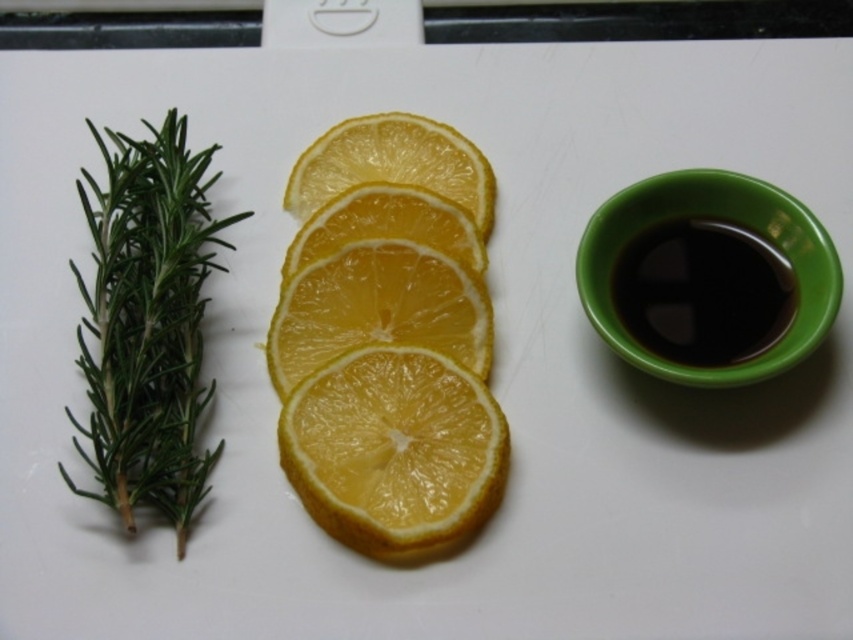
Is green needle-like rosemary at left in front of yellow matte lemon at center?

That is True.

Which is more to the right, green needle-like rosemary at left or yellow matte lemon at center?

From the viewer's perspective, yellow matte lemon at center appears more on the right side.

Describe the element at coordinates (148, 324) in the screenshot. The width and height of the screenshot is (853, 640). I see `green needle-like rosemary at left` at that location.

Find the location of a particular element. green needle-like rosemary at left is located at coordinates (148, 324).

Who is taller, green needle-like rosemary at left or black glossy coffee at right?

Standing taller between the two is green needle-like rosemary at left.

Does green needle-like rosemary at left appear on the right side of black glossy coffee at right?

No, green needle-like rosemary at left is not to the right of black glossy coffee at right.

Who is more distant from viewer, (114, 300) or (704, 333)?

The point (704, 333) is behind.

At what (x,y) coordinates should I click in order to perform the action: click on green needle-like rosemary at left. Please return your answer as a coordinate pair (x, y). Looking at the image, I should click on (148, 324).

Does yellow smooth orange at center have a smaller size compared to yellow matte orange at center?

Actually, yellow smooth orange at center might be larger than yellow matte orange at center.

Does yellow smooth orange at center have a lesser height compared to yellow matte orange at center?

No.

Who is more distant from viewer, (476, 346) or (468, 266)?

Positioned behind is point (468, 266).

The height and width of the screenshot is (640, 853). In order to click on yellow smooth orange at center in this screenshot , I will do `click(378, 308)`.